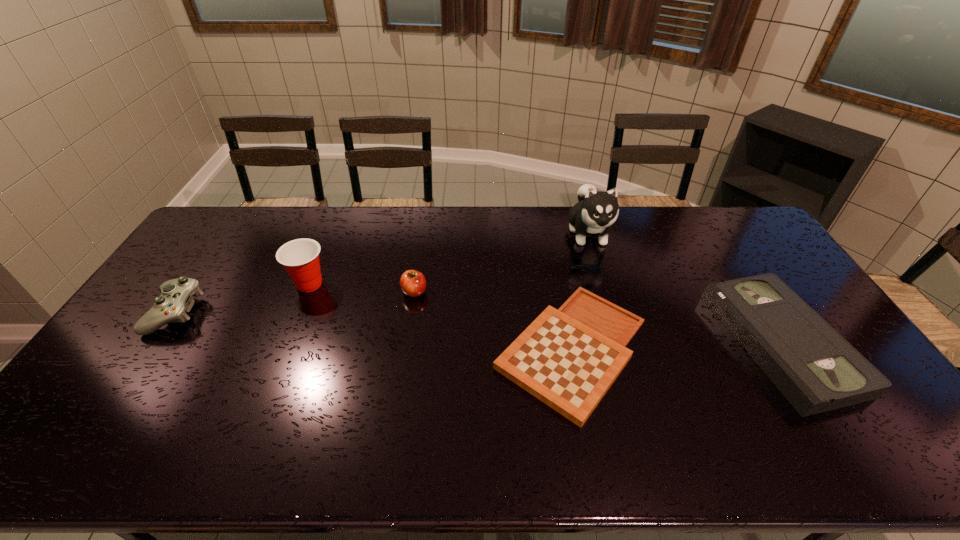
Identify which object is the third nearest to the gameboard. Please provide its 2D coordinates. Your answer should be formatted as a tuple, i.e. [(x, y)], where the tuple contains the x and y coordinates of a point satisfying the conditions above.

[(812, 365)]

You are a GUI agent. You are given a task and a screenshot of the screen. Output one action in this format:
    pyautogui.click(x=<x>, y=<y>)
    Task: Click on the blank space that satisfies the following two spatial constraints: 1. on the front side of the cup; 2. on the left side of the videotape
    
    Given the screenshot: What is the action you would take?
    pyautogui.click(x=285, y=343)

You are a GUI agent. You are given a task and a screenshot of the screen. Output one action in this format:
    pyautogui.click(x=<x>, y=<y>)
    Task: Click on the free space in the image that satisfies the following two spatial constraints: 1. at the face of the farthest object; 2. on the left side of the fifth tallest object
    The width and height of the screenshot is (960, 540).
    Given the screenshot: What is the action you would take?
    pyautogui.click(x=621, y=343)

You are a GUI agent. You are given a task and a screenshot of the screen. Output one action in this format:
    pyautogui.click(x=<x>, y=<y>)
    Task: Click on the vacant position in the image that satisfies the following two spatial constraints: 1. on the front side of the fifth object from right to left; 2. on the left side of the fourth object from right to left
    Image resolution: width=960 pixels, height=540 pixels.
    Given the screenshot: What is the action you would take?
    pyautogui.click(x=306, y=292)

Locate an element on the screen. blank space that satisfies the following two spatial constraints: 1. on the front side of the leftmost object; 2. on the right side of the second shortest object is located at coordinates (154, 343).